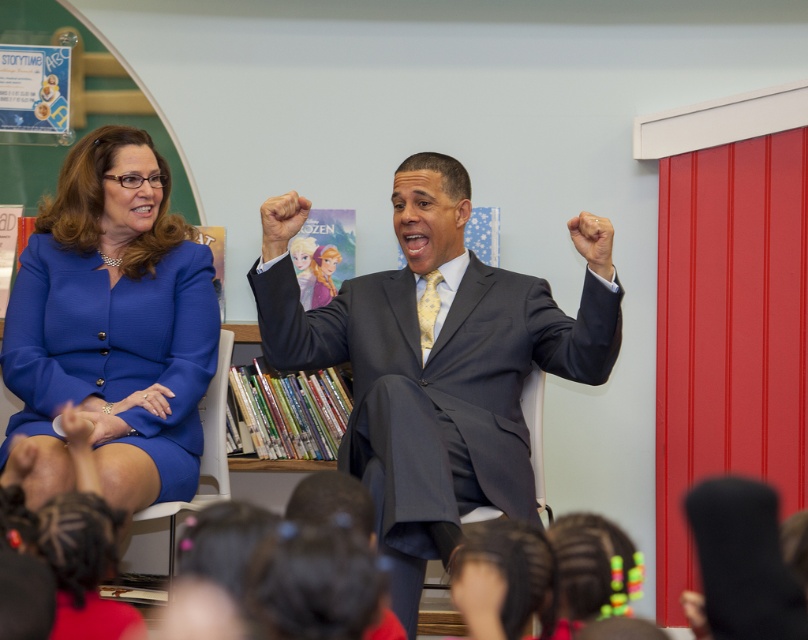
Can you confirm if matte gray suit at center is thinner than smooth skin hand at upper center?

No, matte gray suit at center is not thinner than smooth skin hand at upper center.

Who is lower down, matte gray suit at center or smooth skin hand at upper center?

matte gray suit at center is lower down.

Who is more distant from viewer, (421, 376) or (596, 230)?

Positioned behind is point (421, 376).

Identify the location of matte gray suit at center. The image size is (808, 640). (432, 364).

How distant is blue fabric dress at left from smooth skin hand at upper center?

blue fabric dress at left is 1.24 meters from smooth skin hand at upper center.

Does blue fabric dress at left have a greater width compared to smooth skin hand at upper center?

Yes.

Is point (57, 340) positioned in front of point (600, 262)?

No, (57, 340) is behind (600, 262).

The width and height of the screenshot is (808, 640). Identify the location of blue fabric dress at left. (112, 326).

What do you see at coordinates (432, 364) in the screenshot?
I see `matte gray suit at center` at bounding box center [432, 364].

Consider the image. Does matte gray suit at center appear under blue fabric dress at left?

Yes, matte gray suit at center is below blue fabric dress at left.

You are a GUI agent. You are given a task and a screenshot of the screen. Output one action in this format:
    pyautogui.click(x=<x>, y=<y>)
    Task: Click on the matte gray suit at center
    
    Given the screenshot: What is the action you would take?
    pyautogui.click(x=432, y=364)

You are a GUI agent. You are given a task and a screenshot of the screen. Output one action in this format:
    pyautogui.click(x=<x>, y=<y>)
    Task: Click on the matte gray suit at center
    The image size is (808, 640).
    Given the screenshot: What is the action you would take?
    pyautogui.click(x=432, y=364)